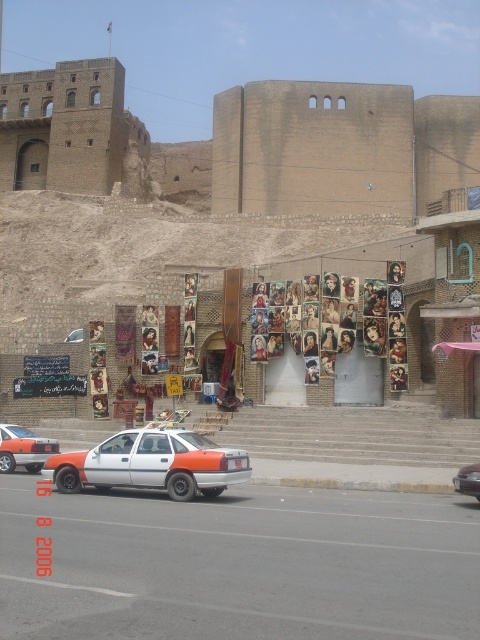
Question: Can you confirm if white plastic car at center is smaller than matte white sedan at center?

Choices:
 (A) no
 (B) yes

Answer: (A)

Question: Which point is farther to the camera?

Choices:
 (A) orange matte car at center
 (B) matte white sedan at center
 (C) white plastic car at center

Answer: (A)

Question: Among these points, which one is farthest from the camera?

Choices:
 (A) (219, 468)
 (B) (471, 496)

Answer: (A)

Question: Is white plastic car at center bigger than matte white sedan at center?

Choices:
 (A) no
 (B) yes

Answer: (B)

Question: Does white plastic car at center have a greater width compared to orange matte sedan at center?

Choices:
 (A) yes
 (B) no

Answer: (A)

Question: Which point is closer to the camera taking this photo?

Choices:
 (A) (212, 452)
 (B) (86, 593)

Answer: (B)